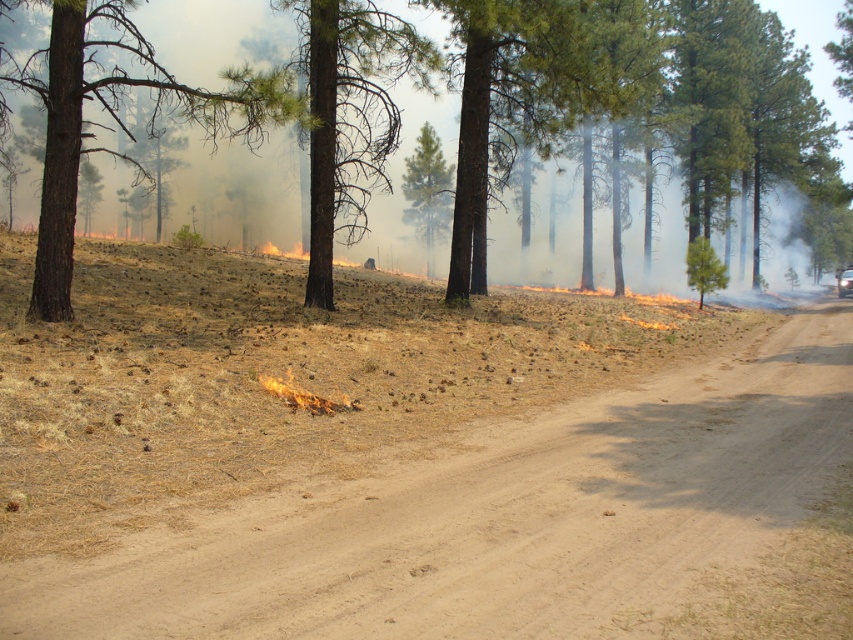
Question: Is brown sandy dirt track at center bigger than flaming yellow-orange fire at center?

Choices:
 (A) no
 (B) yes

Answer: (B)

Question: Does brown rough bark tree at left have a smaller size compared to green rough bark tree at center?

Choices:
 (A) yes
 (B) no

Answer: (B)

Question: Among these objects, which one is nearest to the camera?

Choices:
 (A) brown sandy dirt track at center
 (B) green rough bark tree at center
 (C) brown rough bark tree at left

Answer: (A)

Question: In this image, where is brown sandy dirt track at center located relative to green textured pine tree at center?

Choices:
 (A) below
 (B) above

Answer: (A)

Question: Which point is closer to the camera?

Choices:
 (A) (428, 132)
 (B) (538, 4)

Answer: (B)

Question: Which is nearer to the green rough bark tree at center?

Choices:
 (A) flaming yellow-orange fire at center
 (B) brown rough bark tree at left
 (C) brown sandy dirt track at center

Answer: (B)